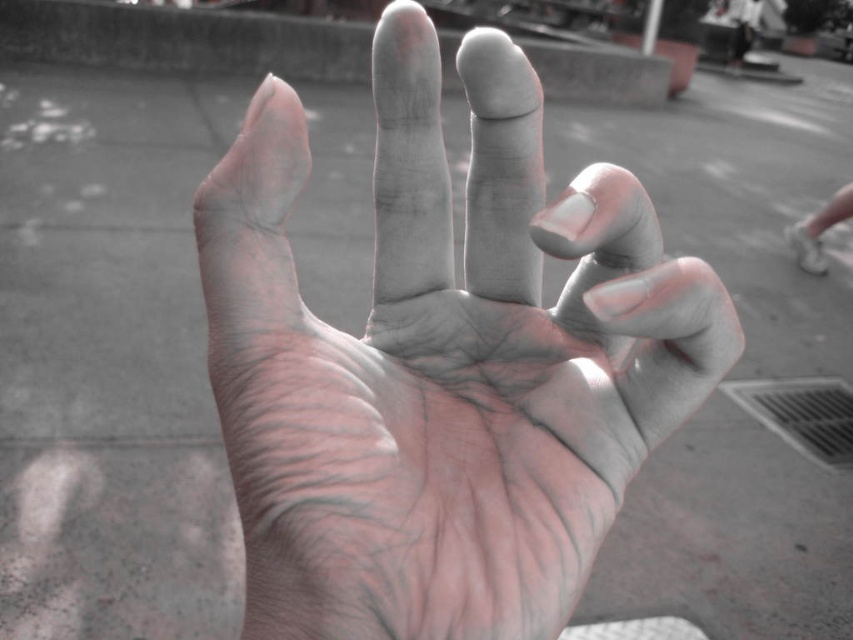
Question: Which object appears farthest from the camera in this image?

Choices:
 (A) white matte shoe at lower right
 (B) smooth skin hand at center

Answer: (A)

Question: Which point is farther to the camera?

Choices:
 (A) white matte shoe at lower right
 (B) smooth skin hand at center

Answer: (A)

Question: Is smooth skin hand at center thinner than white matte shoe at lower right?

Choices:
 (A) yes
 (B) no

Answer: (A)

Question: Is smooth skin hand at center further to the viewer compared to white matte shoe at lower right?

Choices:
 (A) yes
 (B) no

Answer: (B)

Question: Can you confirm if smooth skin hand at center is thinner than white matte shoe at lower right?

Choices:
 (A) yes
 (B) no

Answer: (A)